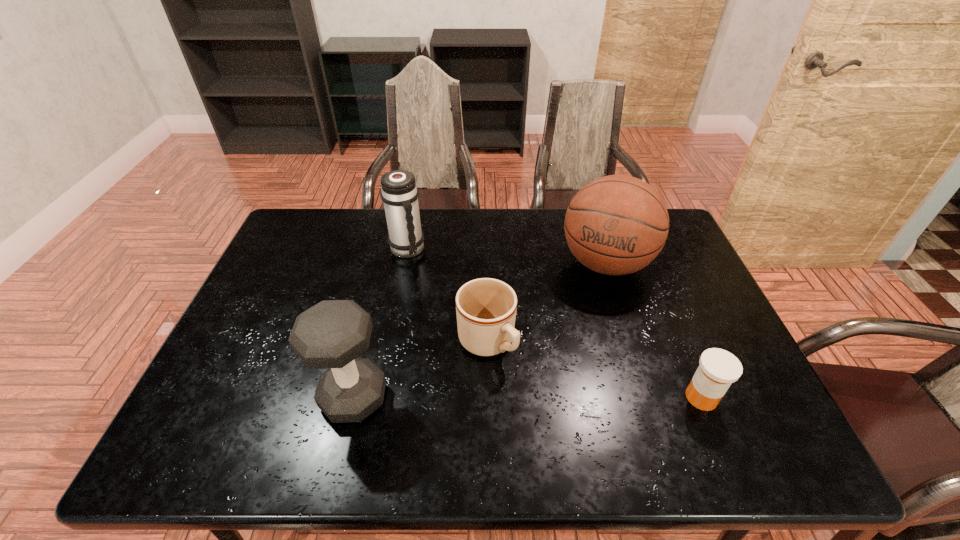
At what (x,y) coordinates should I click in order to perform the action: click on vacant space located on the side with the handle of the thermos bottle. Please return your answer as a coordinate pair (x, y). Looking at the image, I should click on (446, 290).

Locate an element on the screen. The height and width of the screenshot is (540, 960). blank space located 0.090m on the side with the handle of the thermos bottle is located at coordinates (431, 275).

The height and width of the screenshot is (540, 960). I want to click on blank area located 0.220m on the side with the handle of the thermos bottle, so click(456, 300).

Image resolution: width=960 pixels, height=540 pixels. Identify the location of vacant area situated 0.160m on the side of the third nearest object with the handle. click(x=546, y=413).

This screenshot has height=540, width=960. I want to click on free space located 0.070m on the side of the third nearest object with the handle, so click(x=521, y=384).

You are a GUI agent. You are given a task and a screenshot of the screen. Output one action in this format:
    pyautogui.click(x=<x>, y=<y>)
    Task: Click on the free space located 0.180m on the side of the third nearest object with the handle
    
    Given the screenshot: What is the action you would take?
    pyautogui.click(x=552, y=419)

Locate an element on the screen. The width and height of the screenshot is (960, 540). vacant area located 0.070m on the side with brand label of the basketball is located at coordinates (589, 309).

The width and height of the screenshot is (960, 540). In order to click on free spot located on the side with brand label of the basketball in this screenshot , I will do `click(557, 398)`.

This screenshot has width=960, height=540. What are the coordinates of `vacant region located on the side with brand label of the basketball` in the screenshot? It's located at (577, 342).

This screenshot has width=960, height=540. Identify the location of thermos bottle that is at the far edge. (399, 192).